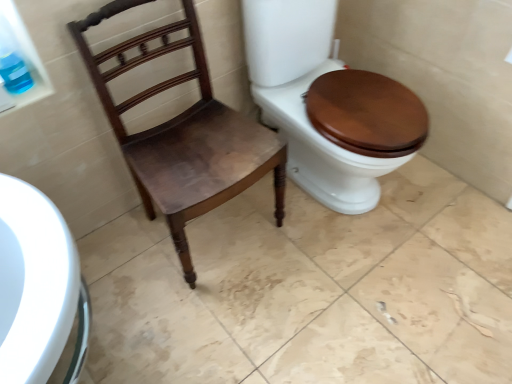
The width and height of the screenshot is (512, 384). Describe the element at coordinates (328, 104) in the screenshot. I see `wooden toilet seat at right` at that location.

What are the coordinates of `wooden toilet seat at right` in the screenshot? It's located at (328, 104).

In order to face wooden toilet seat at right, should I rotate leftwards or rightwards?

Rotate your view right by about 10.869°.

Find the location of a particular element. The height and width of the screenshot is (384, 512). matte brown wood chair at center is located at coordinates (183, 133).

This screenshot has width=512, height=384. Describe the element at coordinates (183, 133) in the screenshot. I see `matte brown wood chair at center` at that location.

You are a GUI agent. You are given a task and a screenshot of the screen. Output one action in this format:
    pyautogui.click(x=<x>, y=<y>)
    Task: Click on the wooden toilet seat at right
    This screenshot has width=512, height=384.
    Given the screenshot: What is the action you would take?
    pyautogui.click(x=328, y=104)

Is matte brown wood chair at center to the left or to the right of wooden toilet seat at right in the image?

In the image, matte brown wood chair at center appears on the left side of wooden toilet seat at right.

Is the position of matte brown wood chair at center less distant than that of wooden toilet seat at right?

That is True.

Which is less distant, (146, 176) or (260, 81)?

Positioned in front is point (146, 176).

Consider the image. From the image's perspective, is matte brown wood chair at center located beneath wooden toilet seat at right?

Indeed, from the image's perspective, matte brown wood chair at center is shown beneath wooden toilet seat at right.

From a real-world perspective, between matte brown wood chair at center and wooden toilet seat at right, who is vertically lower?

matte brown wood chair at center.

Based on the photo, can you confirm if matte brown wood chair at center is wider than wooden toilet seat at right?

Incorrect, the width of matte brown wood chair at center does not surpass that of wooden toilet seat at right.

Which of these two, matte brown wood chair at center or wooden toilet seat at right, stands taller?

Standing taller between the two is wooden toilet seat at right.

Is matte brown wood chair at center bigger or smaller than wooden toilet seat at right?

matte brown wood chair at center is smaller than wooden toilet seat at right.

Is matte brown wood chair at center not within wooden toilet seat at right?

Yes, matte brown wood chair at center is outside of wooden toilet seat at right.

Is matte brown wood chair at center not near wooden toilet seat at right?

Actually, matte brown wood chair at center and wooden toilet seat at right are a little close together.

Is wooden toilet seat at right at the back of matte brown wood chair at center?

No.

How different are the orientations of matte brown wood chair at center and wooden toilet seat at right in degrees?

matte brown wood chair at center and wooden toilet seat at right are facing 6.6e-05 degrees away from each other.

What are the coordinates of `toilet located above the matte brown wood chair at center (from the image's perspective)` in the screenshot? It's located at (328, 104).

Considering the relative positions of wooden toilet seat at right and matte brown wood chair at center in the image provided, is wooden toilet seat at right to the right of matte brown wood chair at center from the viewer's perspective?

Yes.

Does wooden toilet seat at right come behind matte brown wood chair at center?

Result: Yes, wooden toilet seat at right is behind matte brown wood chair at center.

Is point (298, 182) more distant than point (183, 21)?

That is True.

From the image's perspective, is wooden toilet seat at right below matte brown wood chair at center?

No, from the image's perspective, wooden toilet seat at right is not below matte brown wood chair at center.

From a real-world perspective, which object stands above the other?

wooden toilet seat at right is physically above.

Does wooden toilet seat at right have a greater width compared to matte brown wood chair at center?

Yes.

Who is taller, wooden toilet seat at right or matte brown wood chair at center?

wooden toilet seat at right.

Can you confirm if wooden toilet seat at right is smaller than matte brown wood chair at center?

No.

Is wooden toilet seat at right spatially inside matte brown wood chair at center, or outside of it?

wooden toilet seat at right lies outside matte brown wood chair at center.

Is wooden toilet seat at right positioned far away from matte brown wood chair at center?

They are positioned close to each other.

Is matte brown wood chair at center at the back of wooden toilet seat at right?

No, wooden toilet seat at right is not facing the opposite direction of matte brown wood chair at center.

How different are the orientations of wooden toilet seat at right and matte brown wood chair at center in degrees?

The angle between the facing direction of wooden toilet seat at right and the facing direction of matte brown wood chair at center is 6.6e-05 degrees.

Where is `chair below the wooden toilet seat at right (from a real-world perspective)`? The width and height of the screenshot is (512, 384). chair below the wooden toilet seat at right (from a real-world perspective) is located at coordinates (x=183, y=133).

Locate an element on the screen. chair below the wooden toilet seat at right (from the image's perspective) is located at coordinates (183, 133).

Identify the location of chair on the left side of wooden toilet seat at right. The width and height of the screenshot is (512, 384). (183, 133).